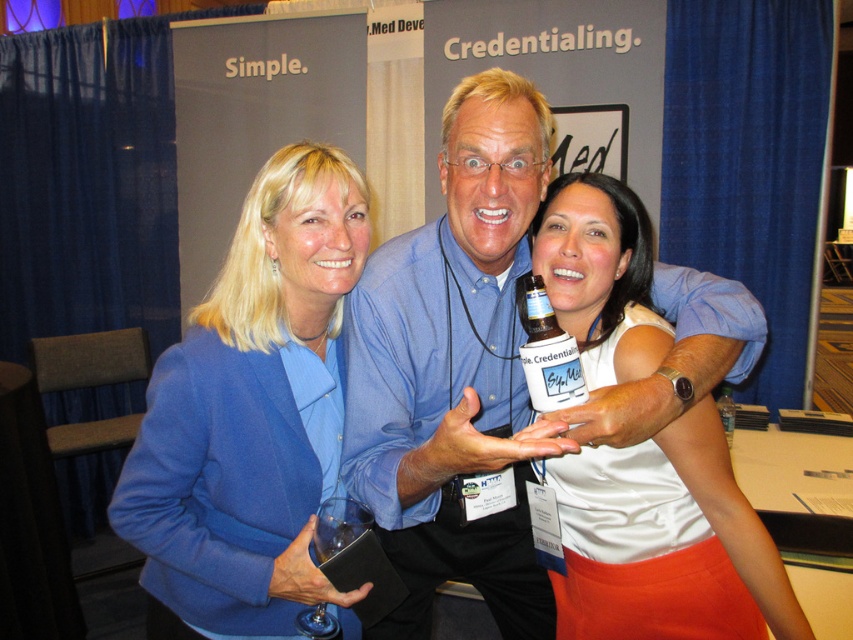
Looking at this image, you are at a professional event and see the blue shirt at center and the translucent plastic bottle at center. Which object is taller?

The blue shirt at center is taller than the translucent plastic bottle at center.

You are an event organizer who needs to retrieve the credentialing bottle from the crowd. You see the blue shirt at center and the translucent plastic bottle at center. Which one should you approach first to get the bottle?

The blue shirt at center is in front of the translucent plastic bottle at center, so you should approach the blue shirt at center first to access the bottle behind them.

You are organizing a photo shoot and need to ensure that the white matte tank top at center and the translucent plastic bottle at center are visible in the final image. Given their sizes, which object should you focus on to ensure both are in frame?

The white matte tank top at center is much taller than the translucent plastic bottle at center, so focusing on the taller object will ensure both are visible in the frame.